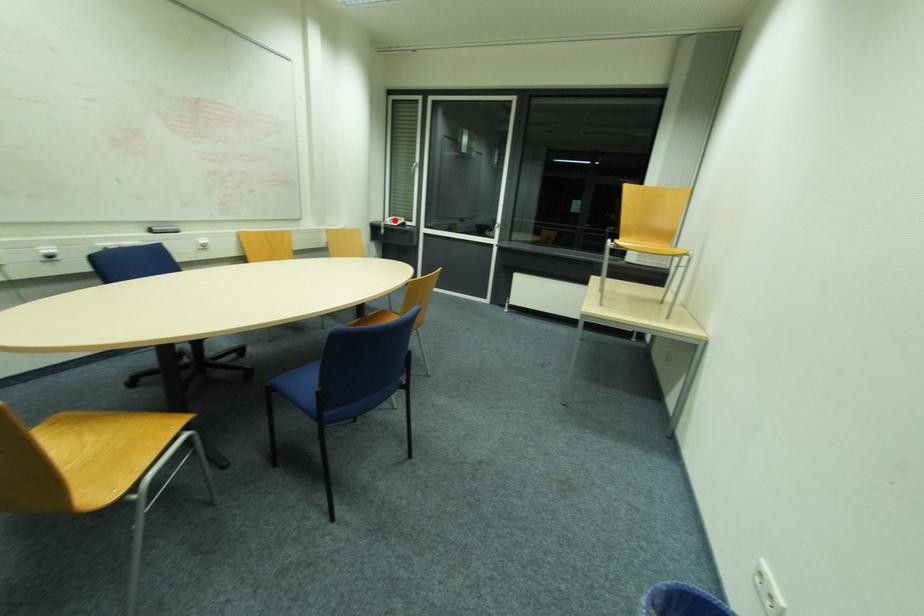
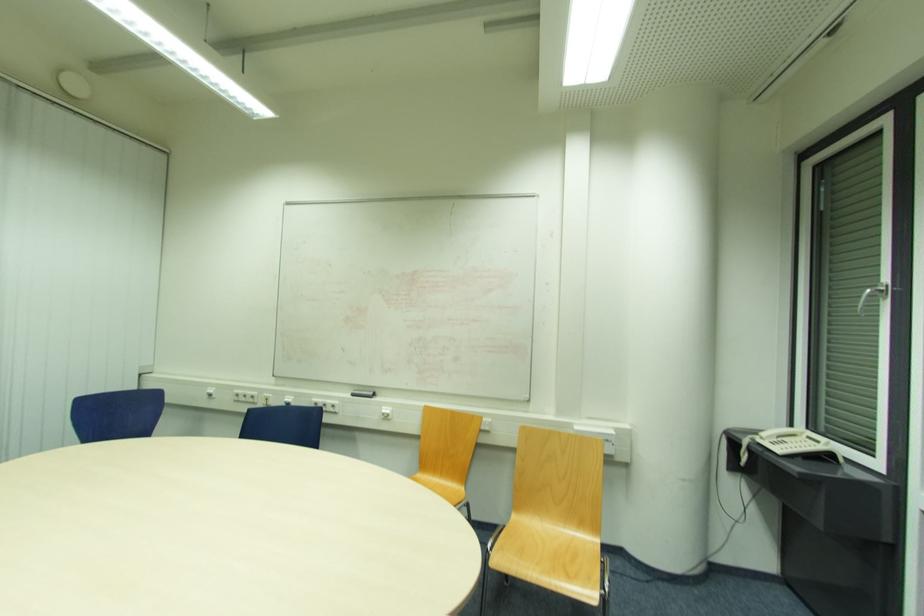
Question: I am providing you with two images of the same scene from different viewpoints. Image1 has a red point marked. In image2, the corresponding 3D location appears at what relative position? Reply with the corresponding letter.

Choices:
 (A) Closer
 (B) Farther

Answer: (B)